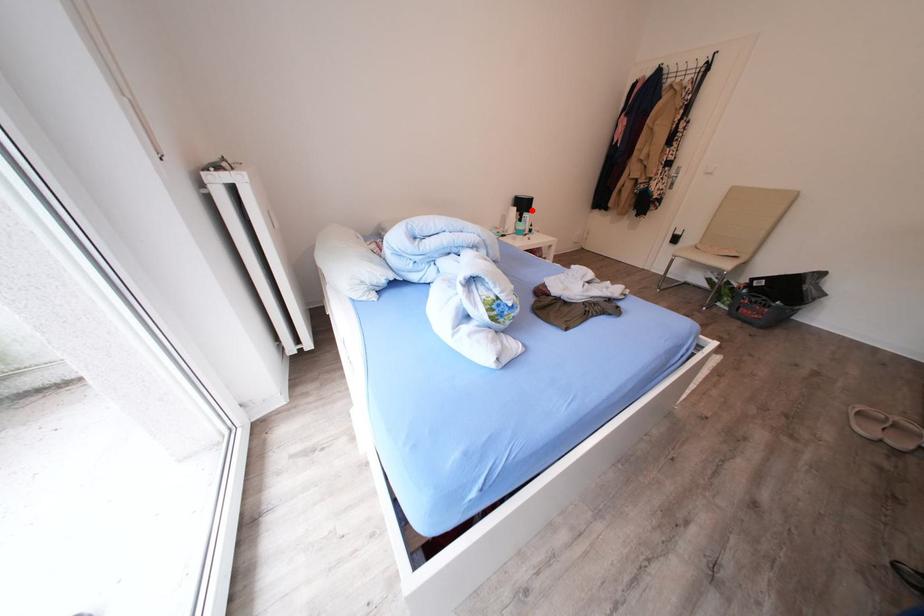
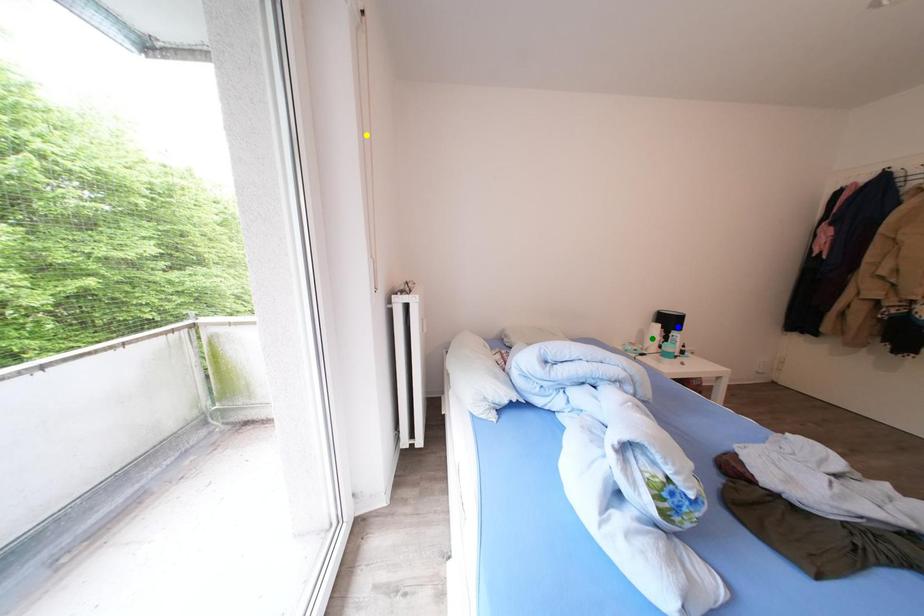
Question: I am providing you with two images of the same scene from different viewpoints. A red point is marked on the first image. You are given multiple points on the second image. In image 2, which mark is for the same physical point as the one in image 1?

Choices:
 (A) blue point
 (B) green point
 (C) yellow point

Answer: (A)